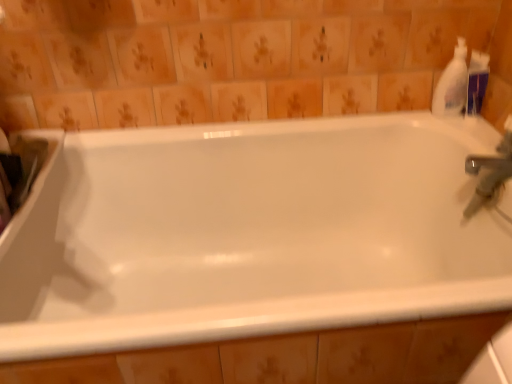
Question: Is white plastic bottle at upper right in front of or behind white glossy bathtub at center in the image?

Choices:
 (A) behind
 (B) front

Answer: (A)

Question: Is white plastic bottle at upper right inside or outside of white glossy bathtub at center?

Choices:
 (A) inside
 (B) outside

Answer: (B)

Question: From the image's perspective, is white plastic bottle at upper right positioned above or below white glossy bathtub at center?

Choices:
 (A) below
 (B) above

Answer: (B)

Question: From a real-world perspective, is white glossy bathtub at center above or below white plastic bottle at upper right?

Choices:
 (A) above
 (B) below

Answer: (B)

Question: Is white glossy bathtub at center taller or shorter than white plastic bottle at upper right?

Choices:
 (A) short
 (B) tall

Answer: (B)

Question: From the image's perspective, is white glossy bathtub at center positioned above or below white plastic bottle at upper right?

Choices:
 (A) below
 (B) above

Answer: (A)

Question: Is white glossy bathtub at center situated inside white plastic bottle at upper right or outside?

Choices:
 (A) outside
 (B) inside

Answer: (A)